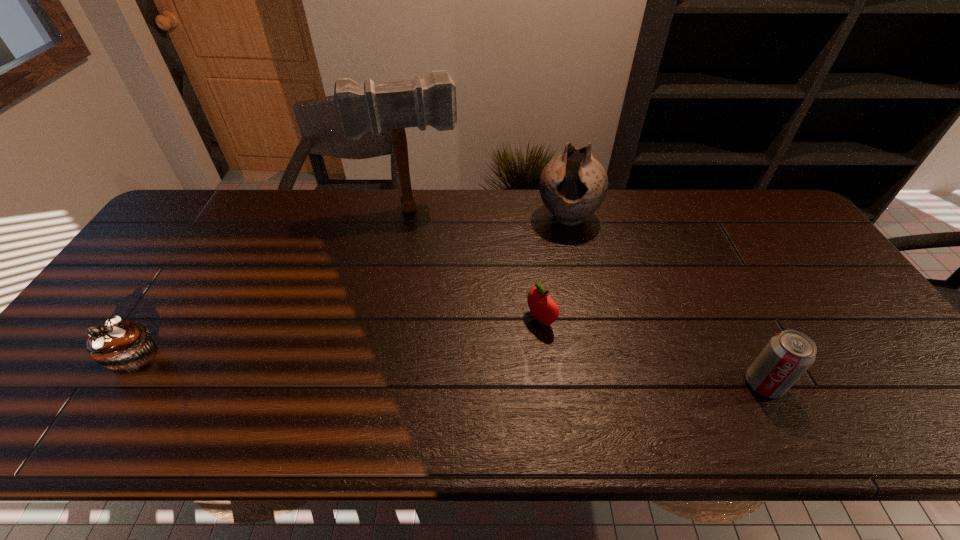
Locate an element on the screen. free space located on the front-facing side of the third farthest object is located at coordinates click(x=420, y=393).

Identify the location of vacant point located 0.300m on the front-facing side of the third farthest object. This screenshot has width=960, height=540. (428, 389).

Identify the location of free space located 0.120m from the spout of the pottery. This screenshot has height=540, width=960. (552, 262).

At what (x,y) coordinates should I click in order to perform the action: click on vacant space located 0.320m from the spout of the pottery. Please return your answer as a coordinate pair (x, y). This screenshot has width=960, height=540. Looking at the image, I should click on (536, 313).

Where is `vacant space located from the spout of the pottery`? vacant space located from the spout of the pottery is located at coordinates (547, 279).

I want to click on free region located 0.360m at the head of the tallest object, so click(x=435, y=307).

Where is `vacant space located 0.260m at the head of the tallest object`? vacant space located 0.260m at the head of the tallest object is located at coordinates point(430,280).

Find the location of a particular element. free location located 0.330m at the head of the tallest object is located at coordinates (433, 299).

Locate an element on the screen. The image size is (960, 540). pottery situated at the far edge is located at coordinates (572, 186).

Find the location of `mallet positioned at the far edge`. mallet positioned at the far edge is located at coordinates (396, 105).